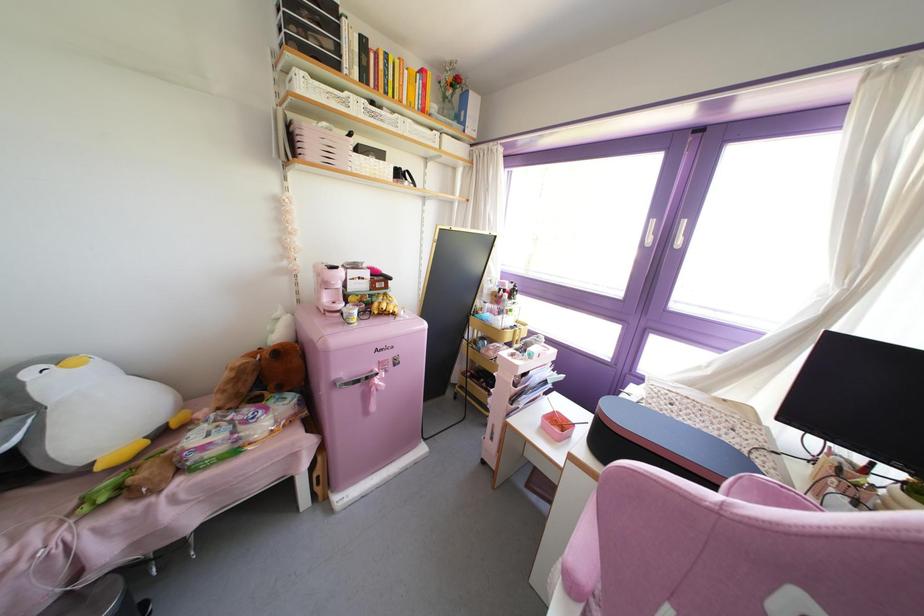
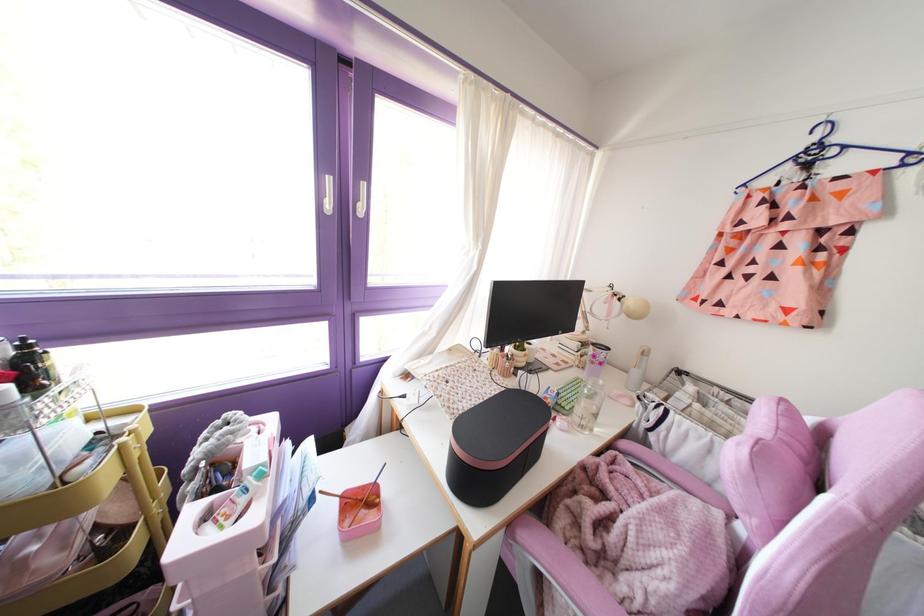
Locate, in the second image, the point that corresponds to (x=565, y=418) in the first image.

(359, 487)